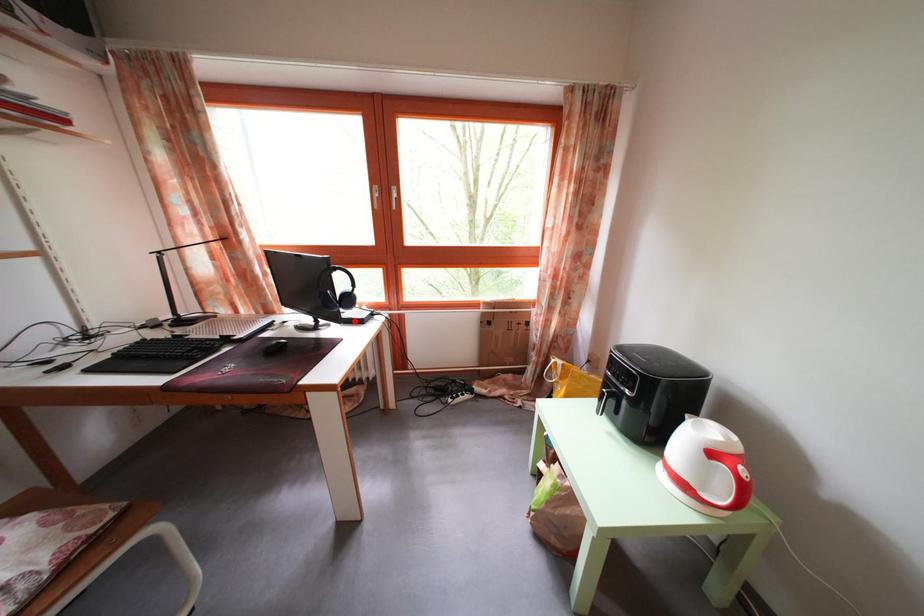
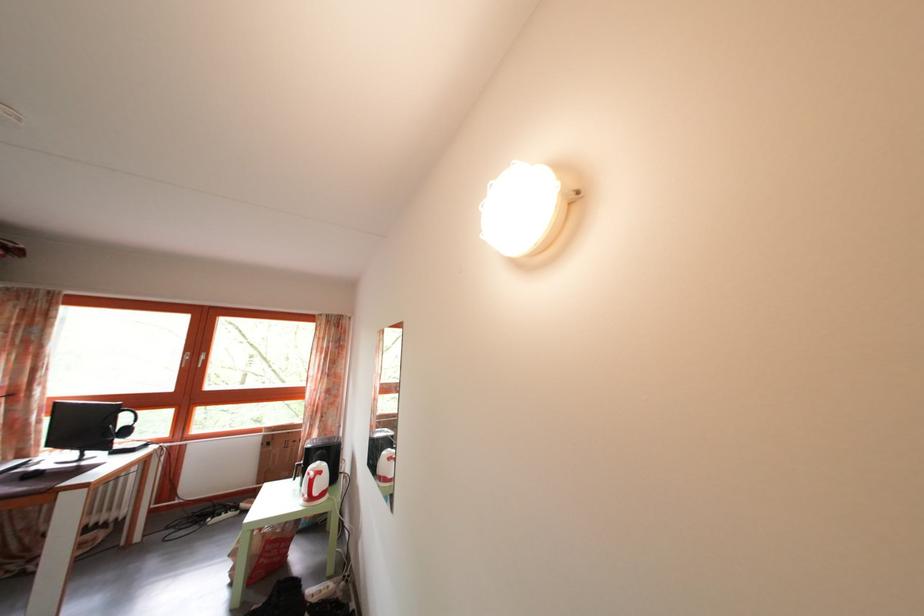
Find the pixel in the second image that matches the highlighted location in the first image.

(128, 451)